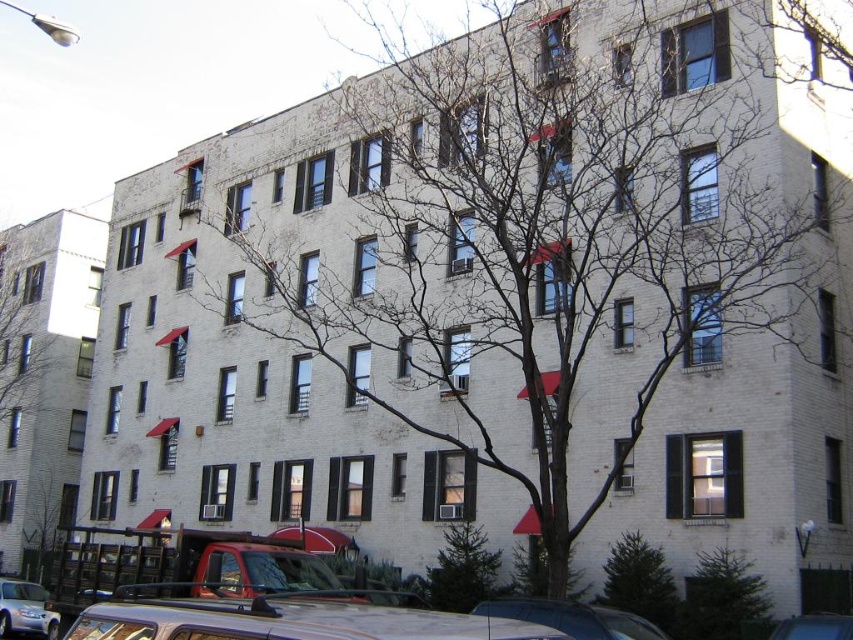
Consider the image. You are standing in front of the residential building and notice a point marked at coordinates (x=721, y=596). Based on the scene description, can you determine what this point is located on?

The point at coordinates (x=721, y=596) is located on the green textured evergreen tree at lower right.

You are standing in front of the residential building and want to determine the relative positions of two points marked on the facade. Which point, point [32,349] or point [758,586], is closer to you?

Point [32,349] is closer to you because it is further to the viewer than point [758,586].

You are standing in front of the building and want to park your car. The metallic silver car at lower center is already parked. Where should you park your car so that it is to the left of the green textured evergreen tree at lower right?

You should park your car to the left of the green textured evergreen tree at lower right, as the metallic silver car at lower center is currently positioned to the right of the tree.